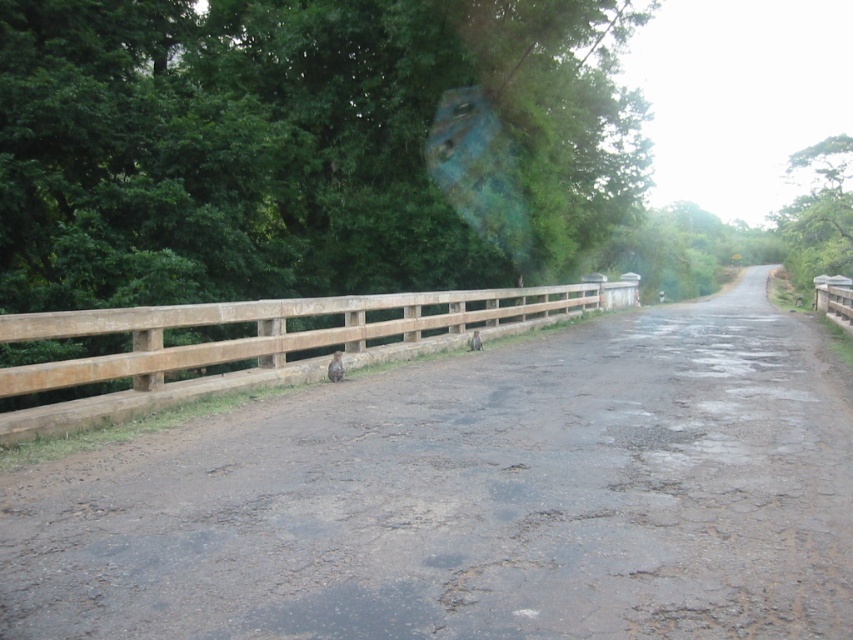
You are a hiker trying to cross the road. You see the brown rough dirt track at center and the brown wooden fence at center. Which one is shorter in height?

The brown rough dirt track at center is not as tall as the brown wooden fence at center, so the brown rough dirt track at center is shorter in height.

You are standing at the point marked as point (592, 486) on the left side of the road. You want to cross the road to reach the dense vegetation on the opposite side. The road is 8 meters wide. Can you safely cross the road without stepping into the road itself?

The point marked as point (592, 486) is already on the left side of the road near the guardrail. To reach the dense vegetation on the opposite side, you would need to cross the entire 8 meters width of the road. Since the point is already at the edge, you can safely step into the road to cross, but the question states not to step into the road. Therefore, it is not possible to reach the vegetation without entering the road.

You are a hiker trying to cross the road safely. You see the brown rough dirt track at center and the brown wooden fence at center. Which one is lower in position?

The brown rough dirt track at center is located below the brown wooden fence at center, so the dirt track is lower in position.